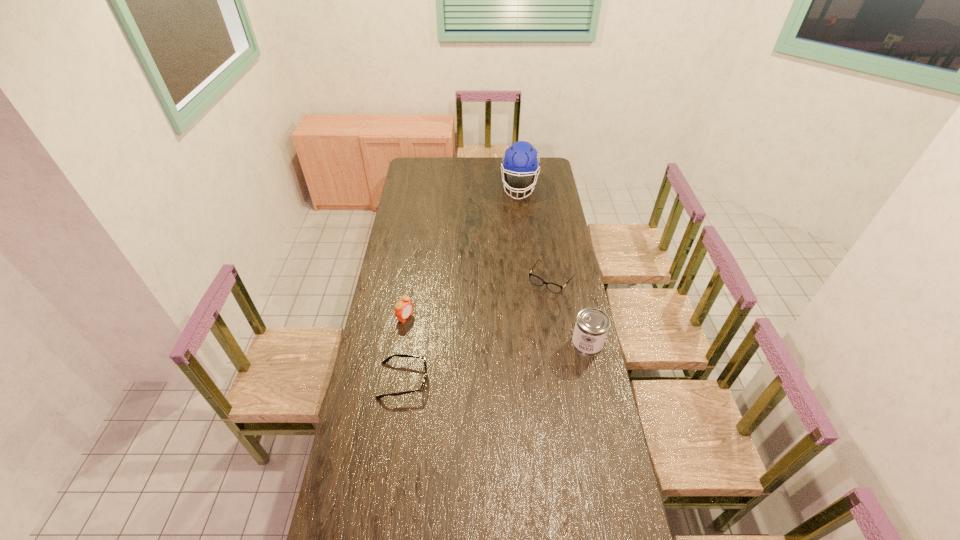
Where is `free space on the desktop that is between the nearer spectacles and the can and is positioned on the front-facing side of the farther spectacles`? The width and height of the screenshot is (960, 540). free space on the desktop that is between the nearer spectacles and the can and is positioned on the front-facing side of the farther spectacles is located at coordinates (492, 363).

This screenshot has width=960, height=540. In order to click on vacant spot on the desktop that is between the nearest object and the second nearest object and is positioned on the face of the alarm clock in this screenshot , I will do `click(497, 362)`.

Identify the location of vacant space on the desktop that is between the left spectacles and the can and is positioned on the front-facing side of the football helmet. (494, 362).